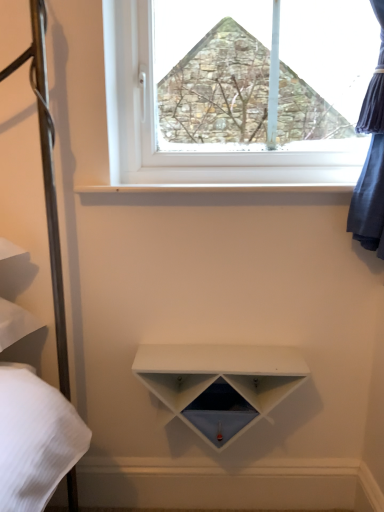
Question: Should I look upward or downward to see white smooth shelf at upper center?

Choices:
 (A) down
 (B) up

Answer: (B)

Question: From the image's perspective, is white smooth shelf at upper center over white matte shelf at center?

Choices:
 (A) no
 (B) yes

Answer: (B)

Question: Is white smooth shelf at upper center wider than white matte shelf at center?

Choices:
 (A) no
 (B) yes

Answer: (B)

Question: Does white smooth shelf at upper center contain white matte shelf at center?

Choices:
 (A) no
 (B) yes

Answer: (A)

Question: Does white smooth shelf at upper center have a larger size compared to white matte shelf at center?

Choices:
 (A) no
 (B) yes

Answer: (A)

Question: Is white smooth shelf at upper center behind white matte shelf at center?

Choices:
 (A) no
 (B) yes

Answer: (B)

Question: Is white smooth shelf at upper center not inside white matte shelf at center?

Choices:
 (A) yes
 (B) no

Answer: (A)

Question: Are white plastic window at upper center and white smooth shelf at upper center far apart?

Choices:
 (A) no
 (B) yes

Answer: (A)

Question: Can you confirm if white plastic window at upper center is positioned to the left of white smooth shelf at upper center?

Choices:
 (A) yes
 (B) no

Answer: (B)

Question: Is white plastic window at upper center bigger than white smooth shelf at upper center?

Choices:
 (A) no
 (B) yes

Answer: (B)

Question: Considering the relative sizes of white plastic window at upper center and white smooth shelf at upper center in the image provided, is white plastic window at upper center thinner than white smooth shelf at upper center?

Choices:
 (A) yes
 (B) no

Answer: (A)

Question: From a real-world perspective, does white plastic window at upper center sit lower than white smooth shelf at upper center?

Choices:
 (A) yes
 (B) no

Answer: (B)

Question: From the image's perspective, would you say white plastic window at upper center is shown under white smooth shelf at upper center?

Choices:
 (A) yes
 (B) no

Answer: (B)

Question: Are white plastic window at upper center and white matte shelf at center located far from each other?

Choices:
 (A) yes
 (B) no

Answer: (B)